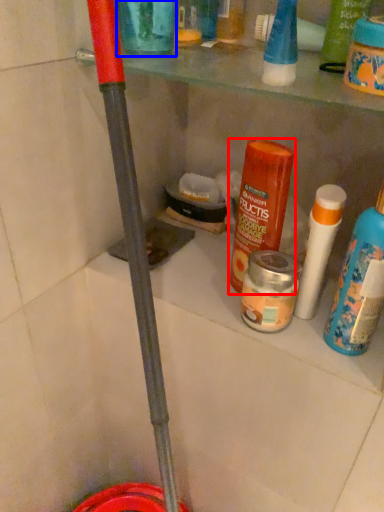
Question: Which of the following is the farthest to the observer, product (highlighted by a red box) or product (highlighted by a blue box)?

Choices:
 (A) product
 (B) product

Answer: (A)